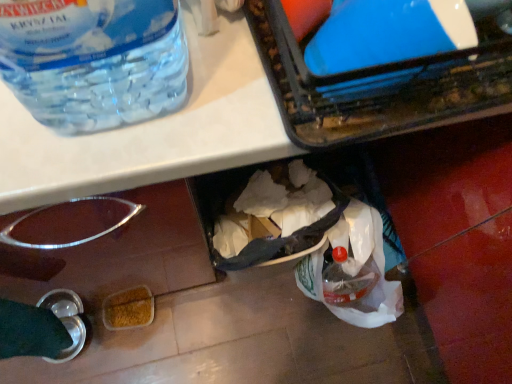
Question: Do you think blue glossy plastic container at upper right is within transparent plastic bottle at upper left, or outside of it?

Choices:
 (A) outside
 (B) inside

Answer: (A)

Question: Based on their positions, is blue glossy plastic container at upper right located to the left or right of transparent plastic bottle at upper left?

Choices:
 (A) right
 (B) left

Answer: (A)

Question: In the image, is blue glossy plastic container at upper right positioned in front of or behind transparent plastic bottle at upper left?

Choices:
 (A) front
 (B) behind

Answer: (B)

Question: Choose the correct answer: Is transparent plastic bottle at upper left inside blue glossy plastic container at upper right or outside it?

Choices:
 (A) outside
 (B) inside

Answer: (A)

Question: Based on their positions, is transparent plastic bottle at upper left located to the left or right of blue glossy plastic container at upper right?

Choices:
 (A) left
 (B) right

Answer: (A)

Question: In the image, is transparent plastic bottle at upper left positioned in front of or behind blue glossy plastic container at upper right?

Choices:
 (A) front
 (B) behind

Answer: (A)

Question: From the image's perspective, relative to blue glossy plastic container at upper right, is transparent plastic bottle at upper left above or below?

Choices:
 (A) below
 (B) above

Answer: (B)